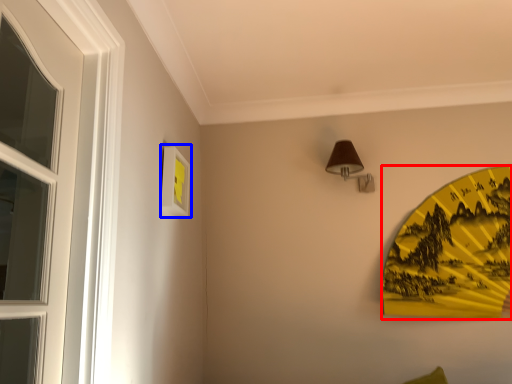
Question: Which object is closer to the camera taking this photo, design (highlighted by a red box) or picture frame (highlighted by a blue box)?

Choices:
 (A) design
 (B) picture frame

Answer: (B)